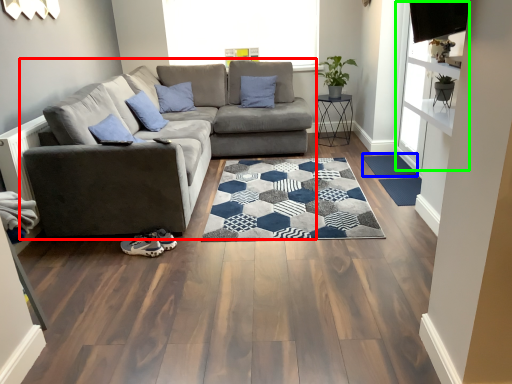
Question: Estimate the real-world distances between objects in this image. Which object is closer to studio couch (highlighted by a red box), doormat (highlighted by a blue box) or window screen (highlighted by a green box)?

Choices:
 (A) doormat
 (B) window screen

Answer: (A)